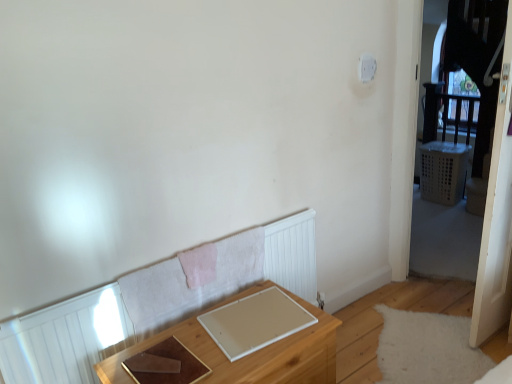
Question: From the image's perspective, does transparent plastic screen door at right appear higher than white plastic light switch at upper right?

Choices:
 (A) yes
 (B) no

Answer: (B)

Question: Could you tell me if transparent plastic screen door at right is facing white plastic light switch at upper right?

Choices:
 (A) yes
 (B) no

Answer: (B)

Question: Considering the relative sizes of transparent plastic screen door at right and white plastic light switch at upper right in the image provided, is transparent plastic screen door at right bigger than white plastic light switch at upper right?

Choices:
 (A) no
 (B) yes

Answer: (B)

Question: Does transparent plastic screen door at right appear on the right side of white plastic light switch at upper right?

Choices:
 (A) yes
 (B) no

Answer: (A)

Question: Does transparent plastic screen door at right come in front of white plastic light switch at upper right?

Choices:
 (A) yes
 (B) no

Answer: (A)

Question: Is transparent plastic screen door at right positioned with its back to white plastic light switch at upper right?

Choices:
 (A) no
 (B) yes

Answer: (B)

Question: Does white plastic light switch at upper right have a larger size compared to transparent plastic screen door at right?

Choices:
 (A) no
 (B) yes

Answer: (A)

Question: Considering the relative sizes of white plastic light switch at upper right and transparent plastic screen door at right in the image provided, is white plastic light switch at upper right shorter than transparent plastic screen door at right?

Choices:
 (A) yes
 (B) no

Answer: (A)

Question: Are white plastic light switch at upper right and transparent plastic screen door at right beside each other?

Choices:
 (A) yes
 (B) no

Answer: (B)

Question: Is white plastic light switch at upper right smaller than transparent plastic screen door at right?

Choices:
 (A) yes
 (B) no

Answer: (A)

Question: From a real-world perspective, is white plastic light switch at upper right physically below transparent plastic screen door at right?

Choices:
 (A) no
 (B) yes

Answer: (A)

Question: Considering the relative positions of white plastic light switch at upper right and transparent plastic screen door at right in the image provided, is white plastic light switch at upper right to the right of transparent plastic screen door at right from the viewer's perspective?

Choices:
 (A) no
 (B) yes

Answer: (A)

Question: Considering the relative sizes of white plastic light switch at upper right and wooden table at lower center in the image provided, is white plastic light switch at upper right bigger than wooden table at lower center?

Choices:
 (A) yes
 (B) no

Answer: (B)